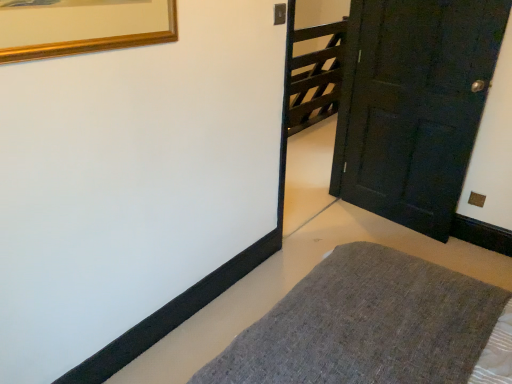
Question: Considering the positions of matte black door at right and dark wood gate at upper right in the image, is matte black door at right wider or thinner than dark wood gate at upper right?

Choices:
 (A) wide
 (B) thin

Answer: (B)

Question: From their relative heights in the image, would you say matte black door at right is taller or shorter than dark wood gate at upper right?

Choices:
 (A) tall
 (B) short

Answer: (A)

Question: Estimate the real-world distances between objects in this image. Which object is closer to the matte black door at right?

Choices:
 (A) dark wood gate at upper right
 (B) textured gray rug at lower center

Answer: (B)

Question: Considering the real-world distances, which object is farthest from the matte black door at right?

Choices:
 (A) textured gray rug at lower center
 (B) dark wood gate at upper right

Answer: (B)